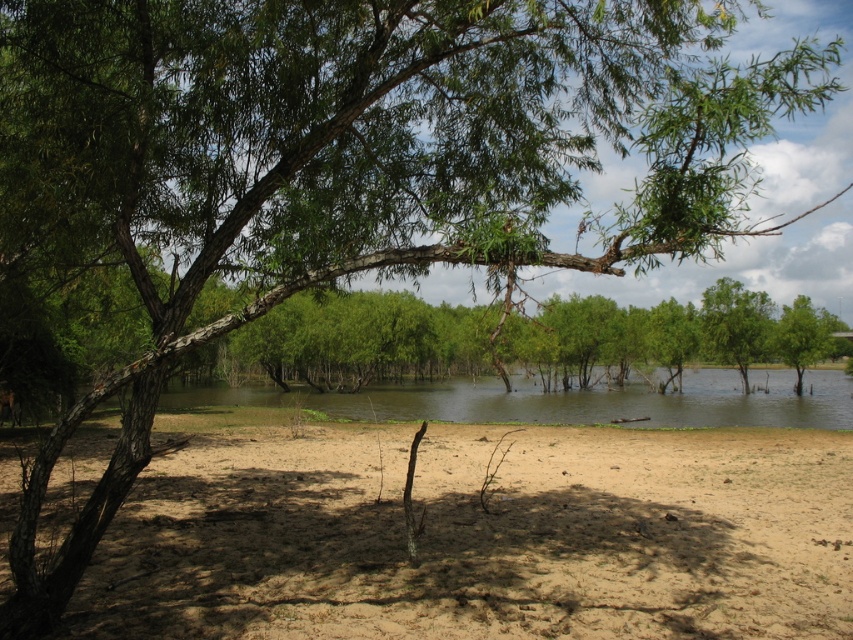
Question: Considering the relative positions of brown sandy dirt at lower center and clear water at center in the image provided, where is brown sandy dirt at lower center located with respect to clear water at center?

Choices:
 (A) right
 (B) left

Answer: (B)

Question: Which point is closer to the camera?

Choices:
 (A) brown sandy dirt at lower center
 (B) clear water at center

Answer: (A)

Question: Which of the following is the closest to the observer?

Choices:
 (A) (700, 376)
 (B) (643, 465)

Answer: (B)

Question: Is brown sandy dirt at lower center wider than clear water at center?

Choices:
 (A) no
 (B) yes

Answer: (A)

Question: Does brown sandy dirt at lower center appear under clear water at center?

Choices:
 (A) yes
 (B) no

Answer: (B)